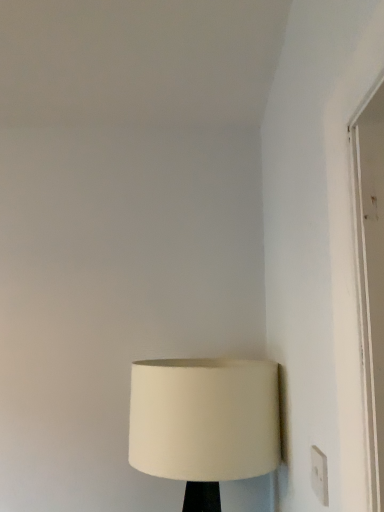
Question: Does white plastic electric outlet at lower right have a smaller size compared to white fabric lampshade at lower center?

Choices:
 (A) no
 (B) yes

Answer: (B)

Question: From a real-world perspective, does white plastic electric outlet at lower right sit lower than white fabric lampshade at lower center?

Choices:
 (A) yes
 (B) no

Answer: (B)

Question: From the image's perspective, is white plastic electric outlet at lower right below white fabric lampshade at lower center?

Choices:
 (A) yes
 (B) no

Answer: (B)

Question: Is white plastic electric outlet at lower right bigger than white fabric lampshade at lower center?

Choices:
 (A) no
 (B) yes

Answer: (A)

Question: Would you say white plastic electric outlet at lower right is outside white fabric lampshade at lower center?

Choices:
 (A) yes
 (B) no

Answer: (A)

Question: Is white plastic electric outlet at lower right directly adjacent to white fabric lampshade at lower center?

Choices:
 (A) no
 (B) yes

Answer: (A)

Question: Does white fabric lampshade at lower center have a lesser width compared to white plastic electric outlet at lower right?

Choices:
 (A) yes
 (B) no

Answer: (B)

Question: Is white fabric lampshade at lower center to the right of white plastic electric outlet at lower right from the viewer's perspective?

Choices:
 (A) yes
 (B) no

Answer: (B)

Question: Does white fabric lampshade at lower center have a lesser height compared to white plastic electric outlet at lower right?

Choices:
 (A) yes
 (B) no

Answer: (B)

Question: From the image's perspective, is white fabric lampshade at lower center beneath white plastic electric outlet at lower right?

Choices:
 (A) yes
 (B) no

Answer: (A)

Question: Can you confirm if white fabric lampshade at lower center is taller than white plastic electric outlet at lower right?

Choices:
 (A) yes
 (B) no

Answer: (A)

Question: Is white fabric lampshade at lower center in front of white plastic electric outlet at lower right?

Choices:
 (A) yes
 (B) no

Answer: (B)

Question: From the image's perspective, is white fabric lampshade at lower center above or below white plastic electric outlet at lower right?

Choices:
 (A) above
 (B) below

Answer: (B)